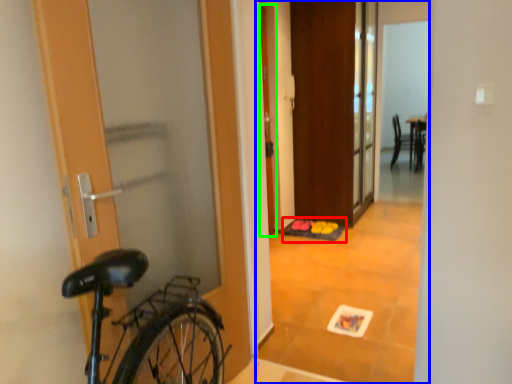
Question: Based on their relative distances, which object is farther from doormat (highlighted by a red box)? Choose from corridor (highlighted by a blue box) and door (highlighted by a green box).

Choices:
 (A) corridor
 (B) door

Answer: (A)